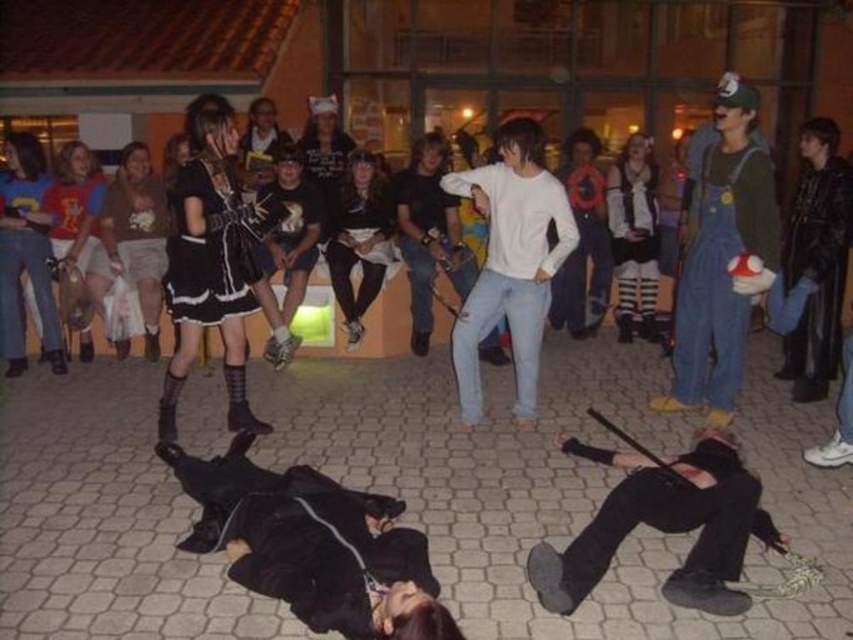
Question: Is black leather jacket at lower center smaller than black leather pants at lower center?

Choices:
 (A) yes
 (B) no

Answer: (B)

Question: Which object is closer to the camera taking this photo?

Choices:
 (A) black leather pants at lower center
 (B) black leather jacket at lower center
 (C) denim overalls at center right
 (D) white cotton shirt at center

Answer: (B)

Question: Which point is closer to the camera?

Choices:
 (A) (721, 506)
 (B) (724, 140)

Answer: (A)

Question: Which point is farther to the camera?

Choices:
 (A) (329, 560)
 (B) (515, 218)
 (C) (206, 308)
 (D) (698, 509)

Answer: (B)

Question: Can you confirm if denim overalls at center right is positioned to the right of white cotton shirt at center?

Choices:
 (A) yes
 (B) no

Answer: (A)

Question: Does black leather jacket at lower center have a smaller size compared to black satin dress at upper left?

Choices:
 (A) yes
 (B) no

Answer: (B)